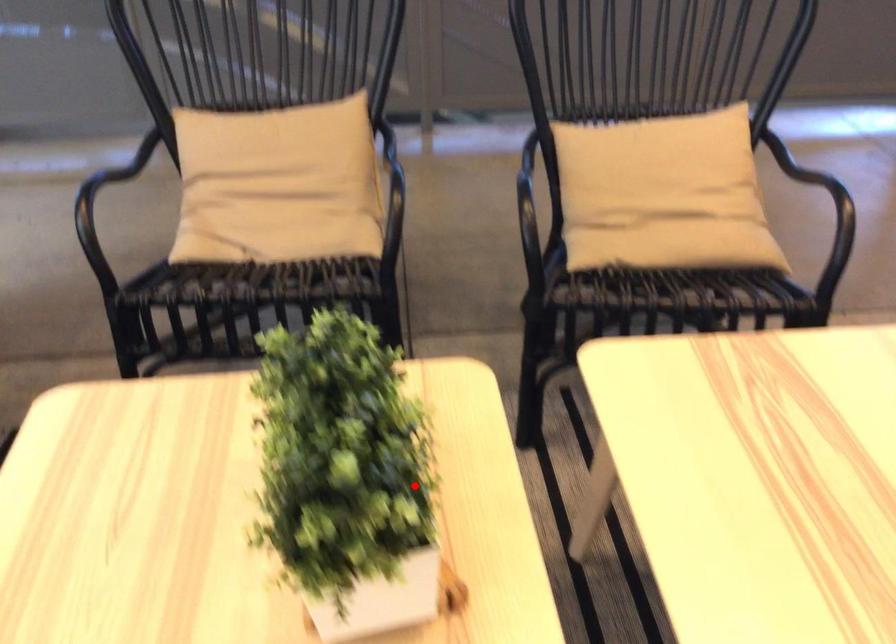
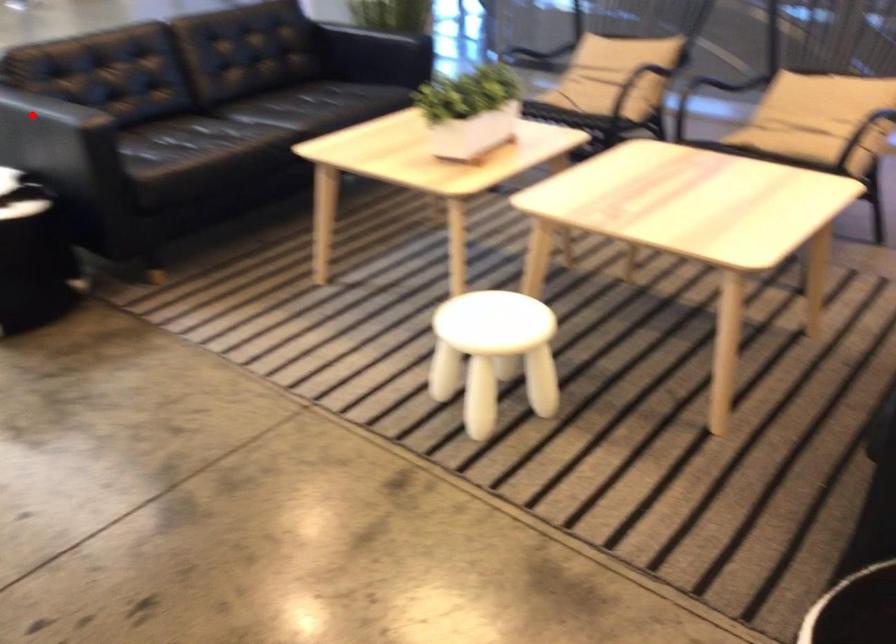
I am providing you with two images of the same scene from different viewpoints. A red point is marked on the first image and another point is marked on the second image. Is the red point in image1 aligned with the point shown in image2?

No